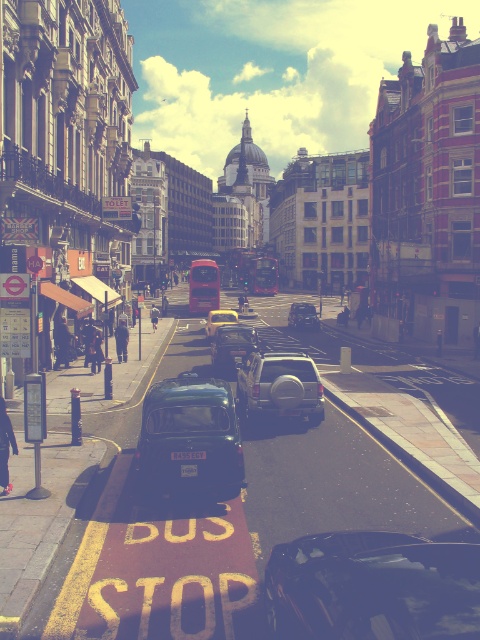
Question: Does glossy black car at center have a smaller size compared to shiny dark green car at center?

Choices:
 (A) yes
 (B) no

Answer: (A)

Question: Which object is the closest to the glossy black car at center?

Choices:
 (A) shiny dark green car at center
 (B) yellow matte taxi at center

Answer: (A)

Question: In this image, where is shiny dark green car at center located relative to matte silver suv at center?

Choices:
 (A) above
 (B) below

Answer: (B)

Question: Which of the following is the closest to the observer?

Choices:
 (A) (186, 467)
 (B) (203, 419)
 (C) (200, 268)
 (D) (314, 324)

Answer: (A)

Question: Considering the relative positions of glossy black car at center and black plastic license plate at center in the image provided, where is glossy black car at center located with respect to black plastic license plate at center?

Choices:
 (A) left
 (B) right

Answer: (B)

Question: Based on their relative distances, which object is farther from the white plastic license plate at center?

Choices:
 (A) shiny silver car at center
 (B) metallic silver car at center
 (C) black plastic license plate at center

Answer: (A)